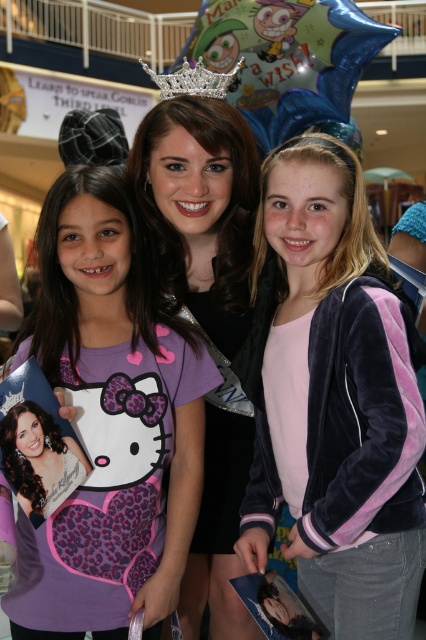
Question: Which point is farther to the camera?

Choices:
 (A) matte black dress at center
 (B) purple matte shirt at center
 (C) velvet purple jacket at center

Answer: (A)

Question: Does purple matte shirt at center come behind silver glittery tiara at upper center?

Choices:
 (A) no
 (B) yes

Answer: (A)

Question: From the image, what is the correct spatial relationship of velvet purple jacket at center in relation to matte black dress at center?

Choices:
 (A) above
 (B) below

Answer: (A)

Question: Where is velvet purple jacket at center located in relation to silver glittery tiara at upper center in the image?

Choices:
 (A) left
 (B) right

Answer: (B)

Question: Which point is closer to the camera?

Choices:
 (A) velvet purple jacket at center
 (B) purple matte shirt at center
 (C) matte black dress at center

Answer: (A)

Question: Which object appears closest to the camera in this image?

Choices:
 (A) matte black photo at center
 (B) velvet purple jacket at center
 (C) purple matte shirt at center
 (D) matte black dress at center

Answer: (B)